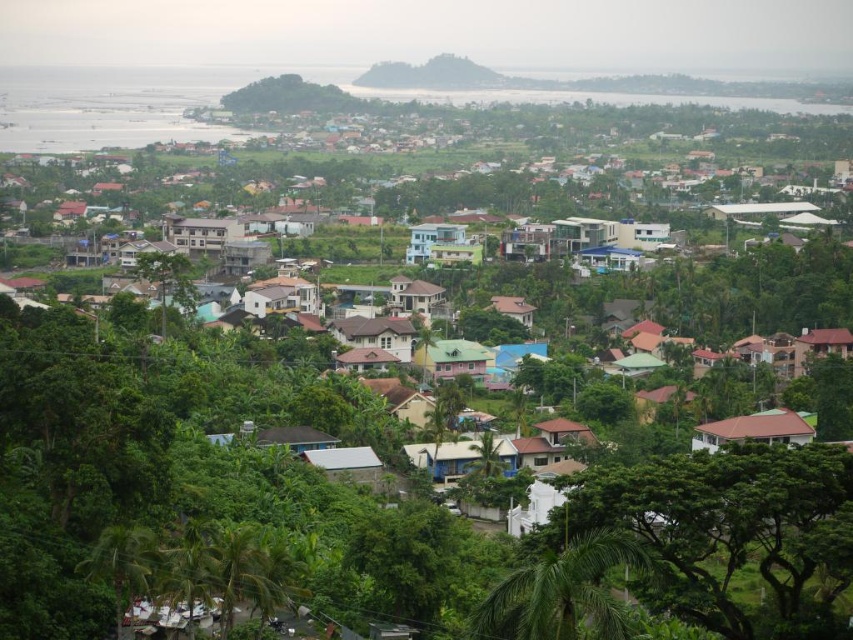
You are standing at the center of the image and want to locate the green leafy tree at lower right. According to the coordinates provided, in which direction should you move to face the tree?

The green leafy tree at lower right is located at coordinates point (728, 532). Since you are at the center, you should move towards the lower right direction to face the tree.

Looking at this image, you are a hiker standing at the edge of the forest looking at the green leafy tree at lower right and the green leafy palm at center. Which tree is taller?

The green leafy tree at lower right is taller than the green leafy palm at center.